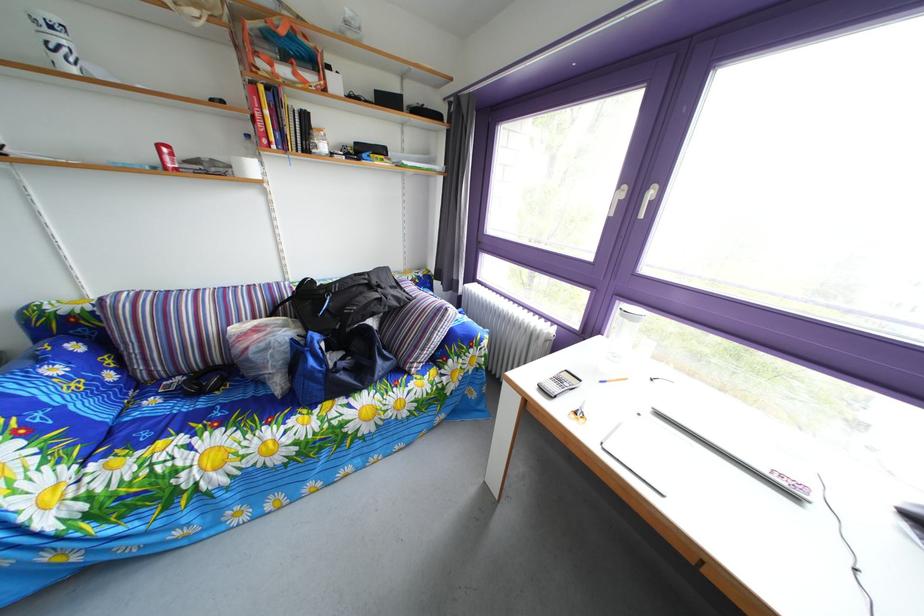
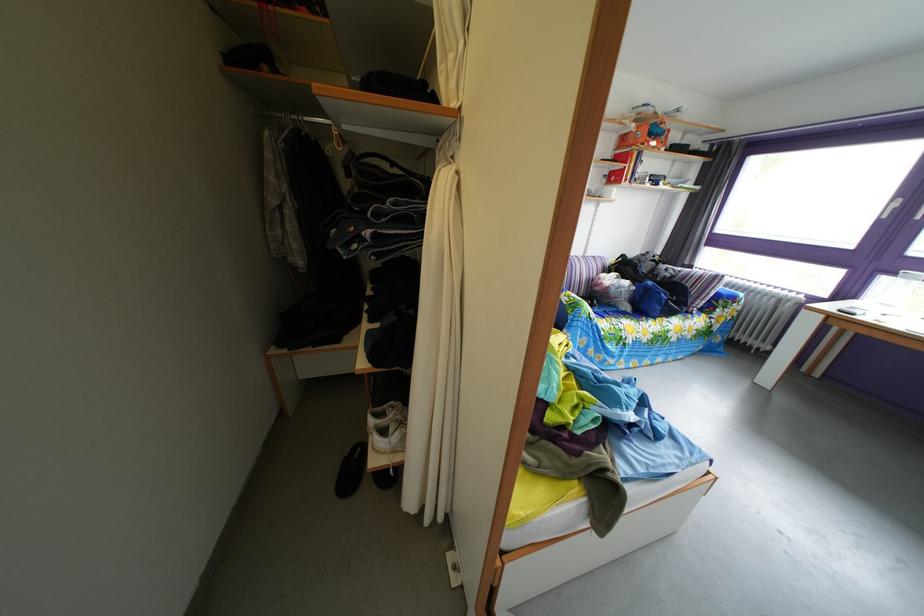
Where in the second image is the point corresponding to (x=296, y=65) from the first image?

(661, 144)